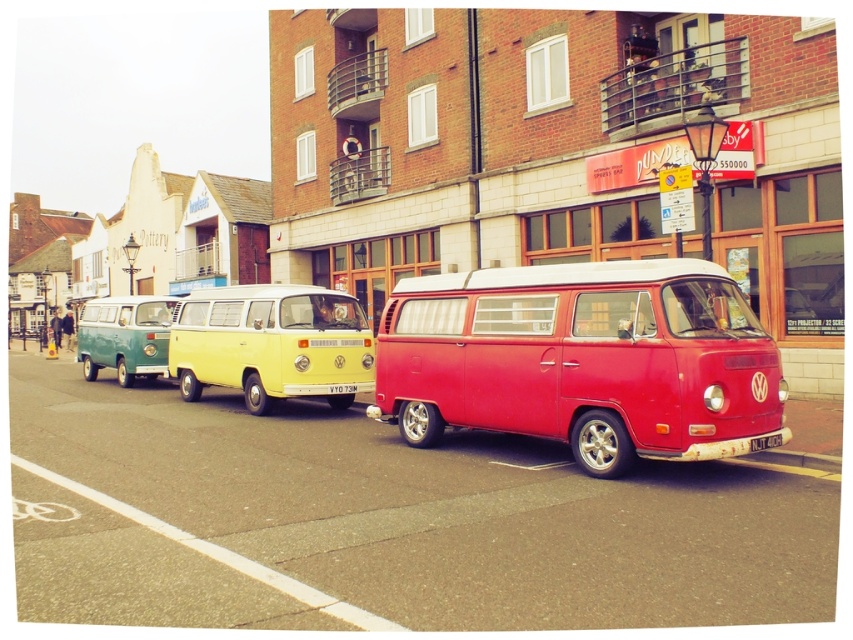
You are standing on the sidewalk in front of the brick building and want to walk to the point marked as point (283, 369). However, there is an obstacle at point (146, 296) blocking your path. Can you safely walk around the obstacle to reach your destination?

Yes, you can safely walk around the obstacle at point (146, 296) because the point you want to reach, point (283, 369), is in front of the obstacle, meaning it is closer to you. You can navigate around the obstacle by moving either to the left or right side of it to reach your destination.

From the picture: You are a delivery person who needs to unload a package that requires a 5 meter clearance between the shiny red van at center and the pastel yellow van at center. Can you safely perform the unloading between them?

The shiny red van at center is 4.62 meters from the pastel yellow van at center. Since the required clearance is 5 meters, the distance is insufficient. Unloading between them may not be safe due to insufficient space.

You are a delivery driver trying to park your truck between the pastel yellow van at center and the teal matte van at left. Considering their heights, will there be enough vertical clearance for your truck that is 2 meters tall?

The pastel yellow van at center is shorter than the teal matte van at left. Since the teal matte van at left is taller, the vertical clearance between them may not be sufficient for a 2 meter tall truck. Check the height of the taller van before proceeding.